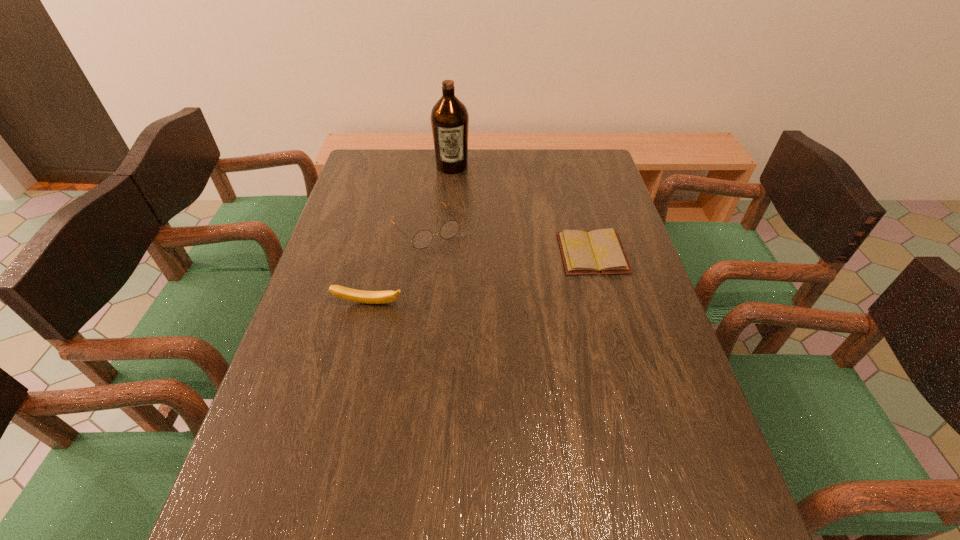
The image size is (960, 540). I want to click on vacant space located 0.100m on the label of the farthest object, so click(x=454, y=192).

The height and width of the screenshot is (540, 960). I want to click on vacant space located 0.340m on the temples of the spectacles, so click(x=505, y=328).

Find the location of a particular element. free location located 0.200m on the temples of the spectacles is located at coordinates (476, 292).

The image size is (960, 540). I want to click on vacant region located on the temples of the spectacles, so click(x=470, y=285).

What are the coordinates of `object positioned at the far edge` in the screenshot? It's located at (449, 117).

At what (x,y) coordinates should I click in order to perform the action: click on object that is at the left edge. Please return your answer as a coordinate pair (x, y). Looking at the image, I should click on (370, 297).

You are a GUI agent. You are given a task and a screenshot of the screen. Output one action in this format:
    pyautogui.click(x=<x>, y=<y>)
    Task: Click on the object at the right edge
    
    Given the screenshot: What is the action you would take?
    pyautogui.click(x=600, y=251)

At what (x,y) coordinates should I click in order to perform the action: click on vacant space at the near edge of the desktop. Please return your answer as a coordinate pair (x, y). The image size is (960, 540). Looking at the image, I should click on (358, 462).

In order to click on vacant region at the left edge of the desktop in this screenshot , I will do `click(281, 446)`.

Where is `free space at the right edge of the desktop`? free space at the right edge of the desktop is located at coordinates click(623, 339).